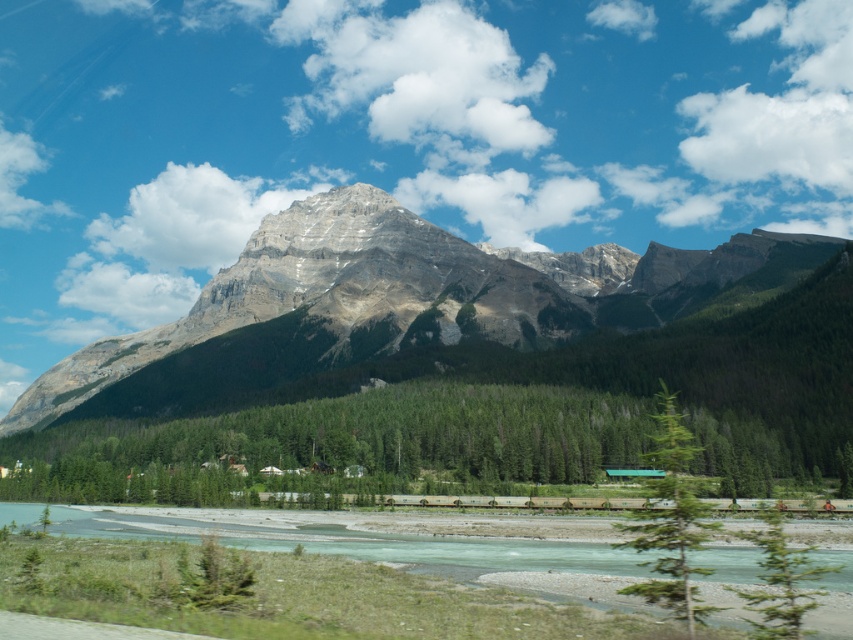
You are an outdoor enthusiast planning a hike. You want to reach the base of the green leafy tree at center before proceeding to the rocky gray mountain at center. Based on the scene, which path would be closer to take first?

The green leafy tree at center is closer to you than the rocky gray mountain at center, so you should head towards the green leafy tree at center first.

You are an environmental scientist observing the mountain landscape. You notice the green leafy tree at center and the green matte forest at center. Which one is closer to the observer?

The green matte forest at center is closer to the observer because the green leafy tree at center is positioned behind it.